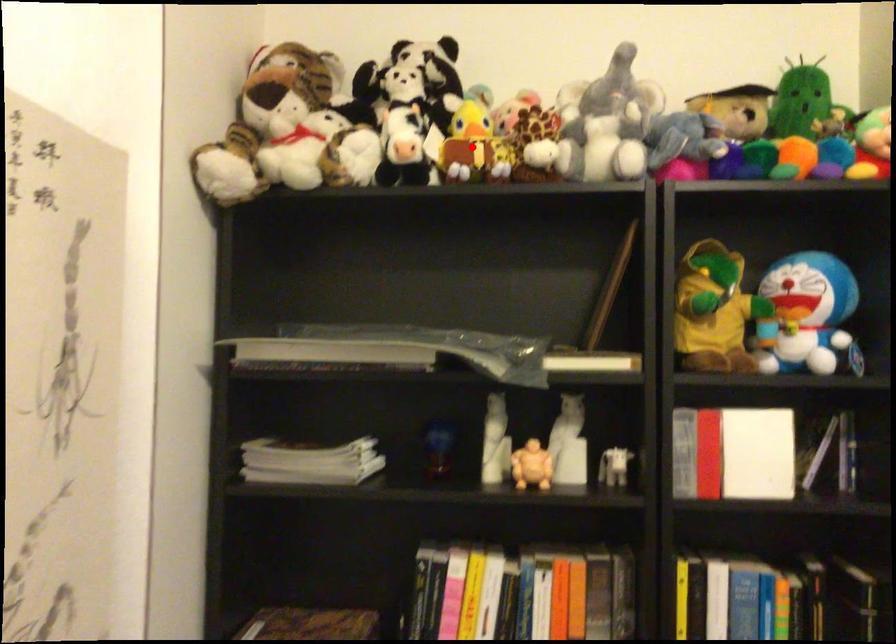
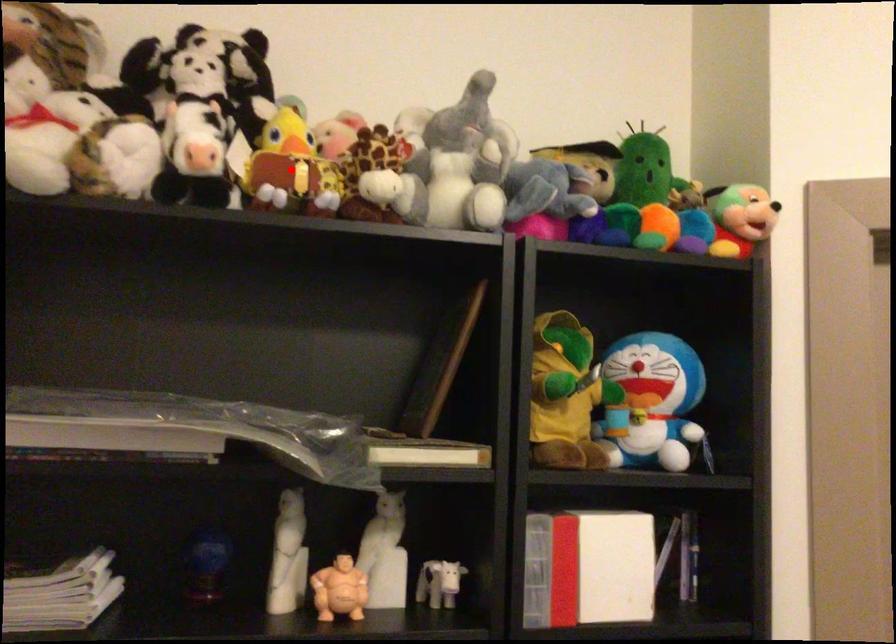
I am providing you with two images of the same scene from different viewpoints. A red point is marked on the first image and another point is marked on the second image. Are the points marked in image1 and image2 representing the same 3D position?

Yes